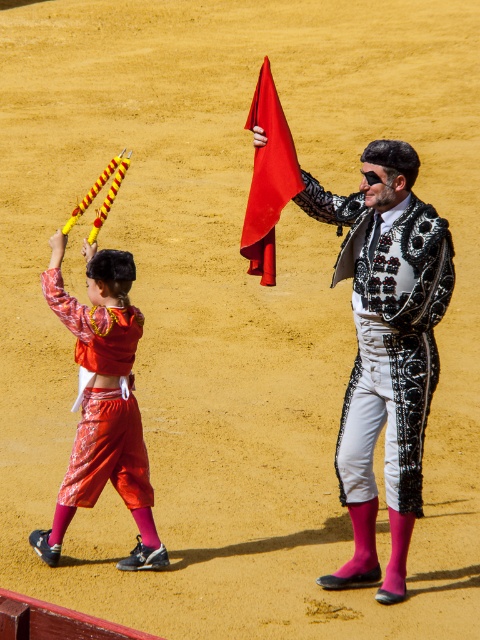
You are a photographer at the bullfighting event. You need to capture a photo where both the shiny red pants at left and the red satin flag at center are visible. Which object should be placed closer to the camera to ensure both fit in the frame?

The shiny red pants at left are wider than the red satin flag at center. To ensure both fit in the frame, place the shiny red pants at left closer to the camera since their greater width requires more space in the photo.

In the bullfighting arena scene, there is a shiny silver vest at center and a red satin flag at center. According to their positions, which object is located to the right side of the other?

The shiny silver vest at center is located to the right of the red satin flag at center.

You are a spectator at the bullfighting event. You notice two items in the image, the shiny silver vest at center and the shiny red pants at left. Which item is positioned higher in the image?

The shiny silver vest at center is located above the shiny red pants at left, so it is positioned higher in the image.